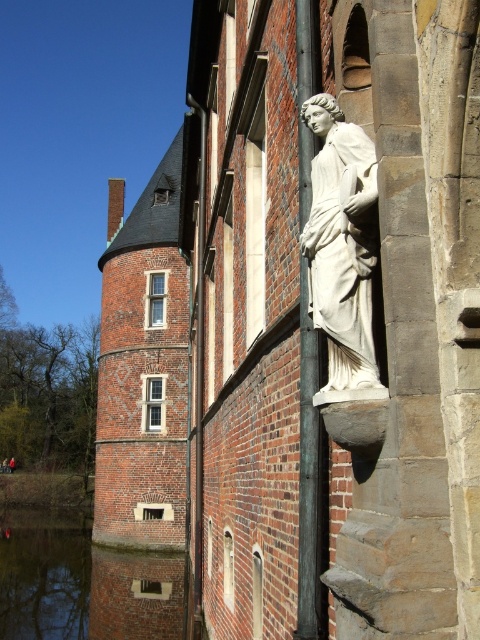
You are standing in front of the historic brick building and want to determine which of the two points, point (357, 236) or point (299, 524), is nearer to you. Based on the scene, which point is closer?

Point (357, 236) is closer to the viewer than point (299, 524).

You are standing at the center of the image. Based on the coordinates provided, in which direction should you look to see the white marble statue at upper right?

The white marble statue at upper right is located at coordinates (342,244), which means it is positioned to the upper right direction from your current position at the center. Therefore, you should look towards the upper right direction to see it.

You are standing in front of the historic brick building and want to take a photo of the white marble statue at upper right and the smooth gray pole at center. Which object should you aim your camera at first if you want to capture both in a single shot without moving the camera?

You should aim your camera at the smooth gray pole at center first because the white marble statue at upper right is above it, so by focusing on the lower object, you can include both in the frame.